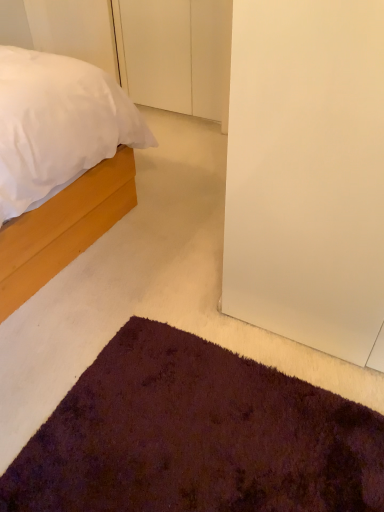
Question: Considering the positions of point (193, 39) and point (89, 80), is point (193, 39) closer or farther from the camera than point (89, 80)?

Choices:
 (A) closer
 (B) farther

Answer: (B)

Question: From the image's perspective, is white matte door at upper center positioned above or below matte wood bed at left?

Choices:
 (A) above
 (B) below

Answer: (A)

Question: Based on their sizes in the image, would you say white matte door at upper center is bigger or smaller than matte wood bed at left?

Choices:
 (A) small
 (B) big

Answer: (A)

Question: Is matte wood bed at left spatially inside white matte door at upper center, or outside of it?

Choices:
 (A) outside
 (B) inside

Answer: (A)

Question: Considering the positions of matte wood bed at left and white matte door at upper center in the image, is matte wood bed at left wider or thinner than white matte door at upper center?

Choices:
 (A) wide
 (B) thin

Answer: (A)

Question: From their relative heights in the image, would you say matte wood bed at left is taller or shorter than white matte door at upper center?

Choices:
 (A) short
 (B) tall

Answer: (B)

Question: In terms of size, does matte wood bed at left appear bigger or smaller than white matte door at upper center?

Choices:
 (A) small
 (B) big

Answer: (B)